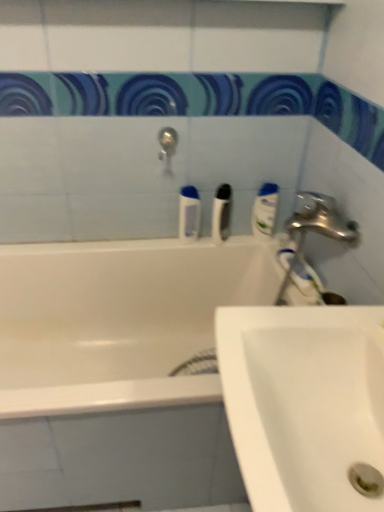
Question: Considering the relative sizes of white glossy bathtub at center and white glossy mouthwash at upper right, which ranks as the first mouthwash in right-to-left order, in the image provided, is white glossy bathtub at center wider than white glossy mouthwash at upper right, which ranks as the first mouthwash in right-to-left order,?

Choices:
 (A) yes
 (B) no

Answer: (A)

Question: Does white glossy bathtub at center have a greater height compared to white glossy mouthwash at upper right, acting as the second mouthwash starting from the left?

Choices:
 (A) no
 (B) yes

Answer: (B)

Question: Can you confirm if white glossy bathtub at center is shorter than white glossy mouthwash at upper right, which ranks as the first mouthwash in right-to-left order?

Choices:
 (A) yes
 (B) no

Answer: (B)

Question: Can you confirm if white glossy bathtub at center is positioned to the left of white glossy mouthwash at upper right, which ranks as the first mouthwash in right-to-left order?

Choices:
 (A) no
 (B) yes

Answer: (B)

Question: Is white glossy bathtub at center closer to the viewer compared to white glossy mouthwash at upper right, acting as the second mouthwash starting from the left?

Choices:
 (A) yes
 (B) no

Answer: (A)

Question: Could you tell me if white glossy bathtub at center is facing white glossy mouthwash at upper right, which ranks as the first mouthwash in right-to-left order?

Choices:
 (A) no
 (B) yes

Answer: (A)

Question: From the image's perspective, would you say blue glossy mouthwash at center, the first mouthwash from the left, is shown under silver metallic tap at upper center?

Choices:
 (A) no
 (B) yes

Answer: (B)

Question: From a real-world perspective, is blue glossy mouthwash at center, the second mouthwash viewed from the right, physically below silver metallic tap at upper center?

Choices:
 (A) no
 (B) yes

Answer: (B)

Question: Does blue glossy mouthwash at center, the first mouthwash from the left, have a greater width compared to silver metallic tap at upper center?

Choices:
 (A) no
 (B) yes

Answer: (A)

Question: Does blue glossy mouthwash at center, the first mouthwash from the left, have a lesser width compared to silver metallic tap at upper center?

Choices:
 (A) yes
 (B) no

Answer: (A)

Question: Does blue glossy mouthwash at center, the second mouthwash viewed from the right, appear on the left side of silver metallic tap at upper center?

Choices:
 (A) yes
 (B) no

Answer: (B)

Question: Is blue glossy mouthwash at center, the first mouthwash from the left, smaller than silver metallic tap at upper center?

Choices:
 (A) yes
 (B) no

Answer: (B)

Question: Does white glossy bathtub at upper center have a lesser width compared to white ceramic sink at lower right?

Choices:
 (A) no
 (B) yes

Answer: (A)